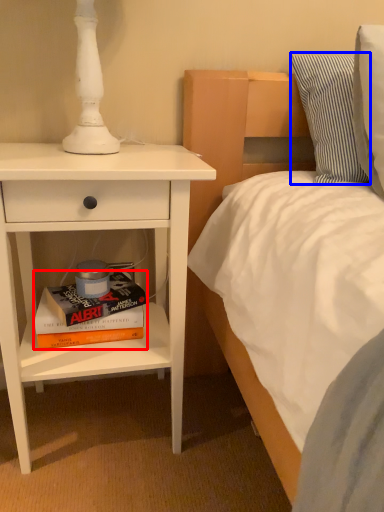
Question: Which object appears farthest to the camera in this image, book (highlighted by a red box) or pillow (highlighted by a blue box)?

Choices:
 (A) book
 (B) pillow

Answer: (A)